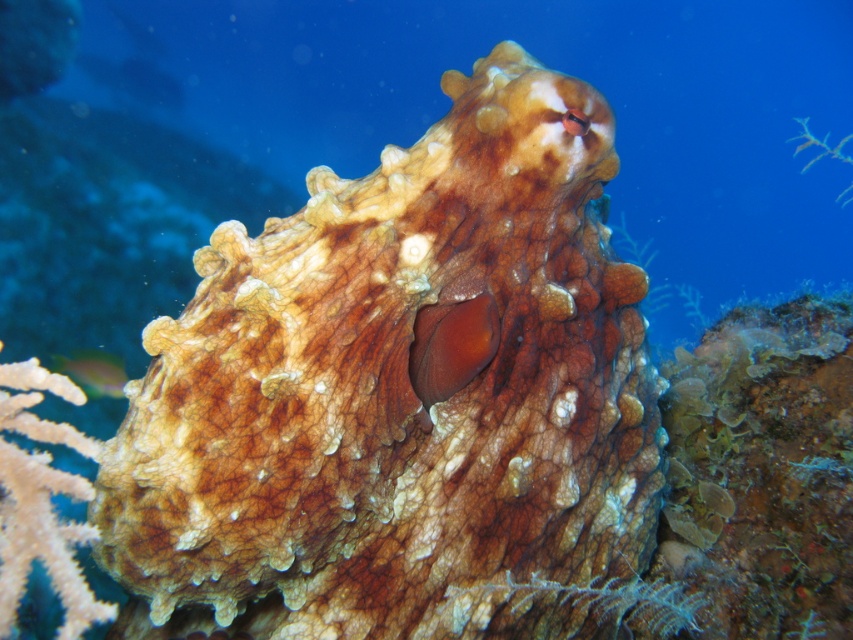
You are a marine biologist observing an octopus underwater. You notice a point at coordinates point (x=514, y=301). If your camera is positioned 1.16 meters away from this point, can you confirm whether the camera is close enough to capture the octopus in detail?

The point (x=514, y=301) and the camera are 1.16 meters apart. Since the camera is positioned at this distance, it is close enough to capture the octopus in detail as the distance matches the required proximity.

You are a marine biologist observing an underwater scene. You notice the brown textured octopus at center and the shiny green fish at lower left. Which one is located to the right side of the other?

The brown textured octopus at center is positioned on the right side of the shiny green fish at lower left.

You are a marine biologist observing an underwater scene. You notice a brown textured octopus at center and a shiny green fish at lower left. Which creature has a greater height in this image?

The brown textured octopus at center is much taller than the shiny green fish at lower left.